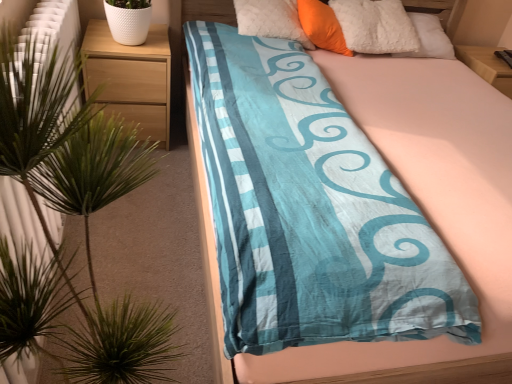
Locate an element on the screen. free space above wooden nightstand at left (from a real-world perspective) is located at coordinates (123, 44).